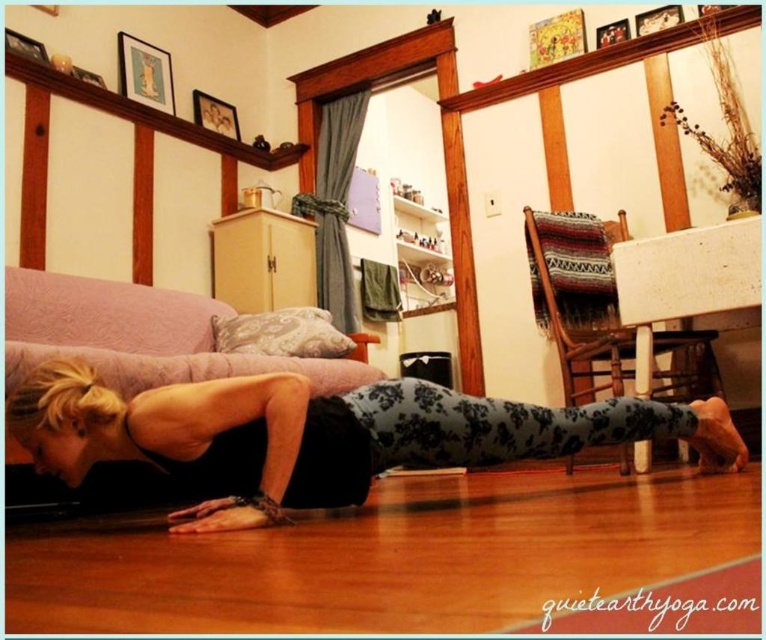
Is point (431, 419) farther from viewer compared to point (264, 365)?

No, it is in front of (264, 365).

Between point (362, 451) and point (345, 384), which one is positioned in front?

Point (362, 451)

I want to click on black floral leggings at lower center, so click(x=319, y=435).